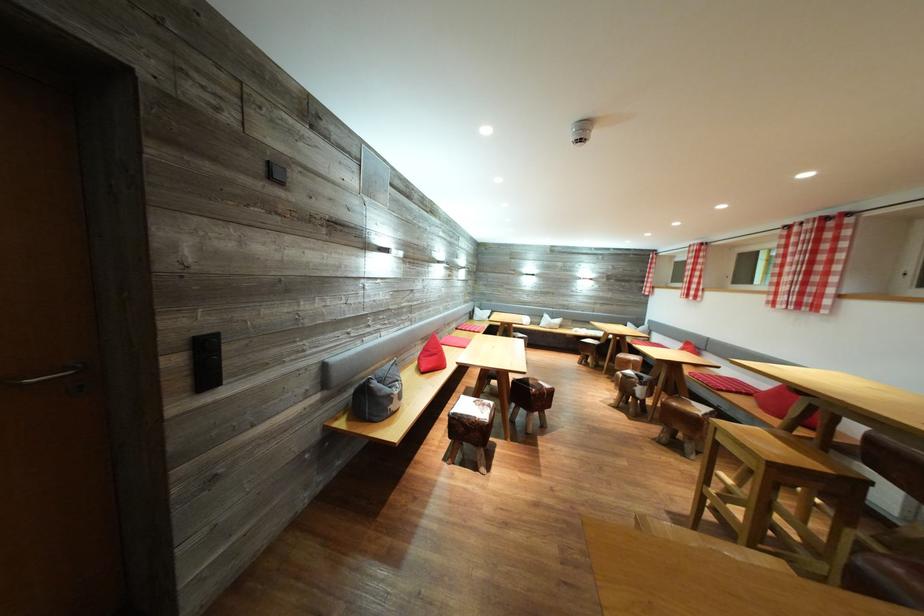
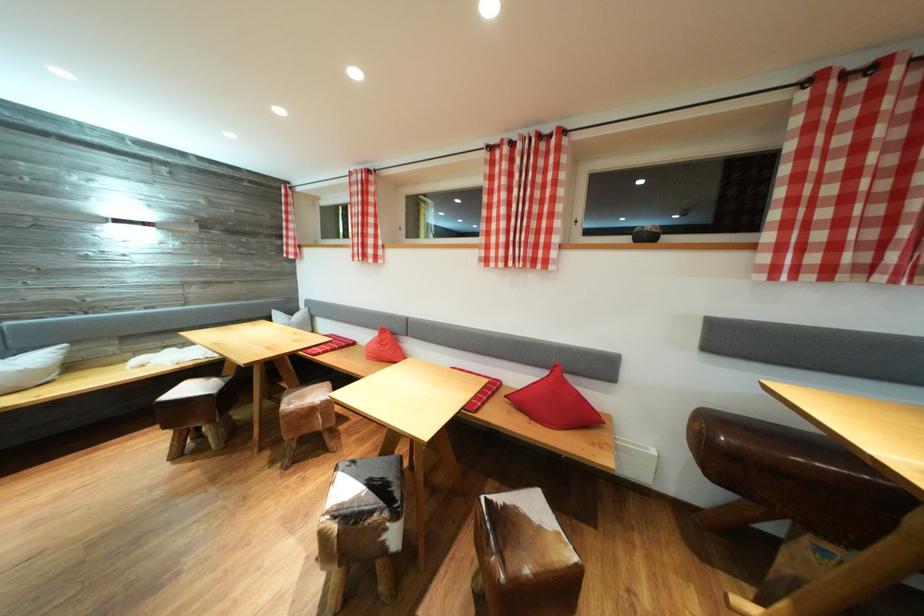
Find the pixel in the second image that matches (x=695, y=349) in the first image.

(390, 336)